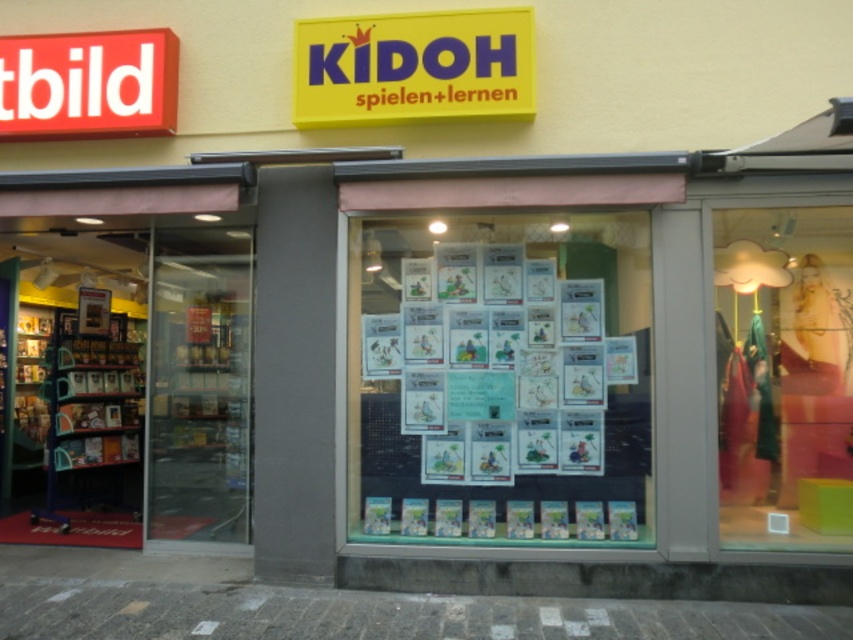
Question: Which point appears closest to the camera in this image?

Choices:
 (A) (350, 90)
 (B) (834, 492)
 (C) (129, 35)
 (D) (637, 380)

Answer: (D)

Question: Which point appears farthest from the camera in this image?

Choices:
 (A) (567, 236)
 (B) (109, 54)
 (C) (844, 356)

Answer: (C)

Question: Considering the relative positions of white paper posters at center and red plastic sign at upper left in the image provided, where is white paper posters at center located with respect to red plastic sign at upper left?

Choices:
 (A) below
 (B) above

Answer: (A)

Question: Can you confirm if white paper posters at center is positioned below red plastic sign at upper left?

Choices:
 (A) yes
 (B) no

Answer: (A)

Question: Is matte pink dress at right thinner than yellow plastic sign at upper center?

Choices:
 (A) no
 (B) yes

Answer: (B)

Question: Which point appears closest to the camera in this image?

Choices:
 (A) (367, 104)
 (B) (381, 298)

Answer: (A)